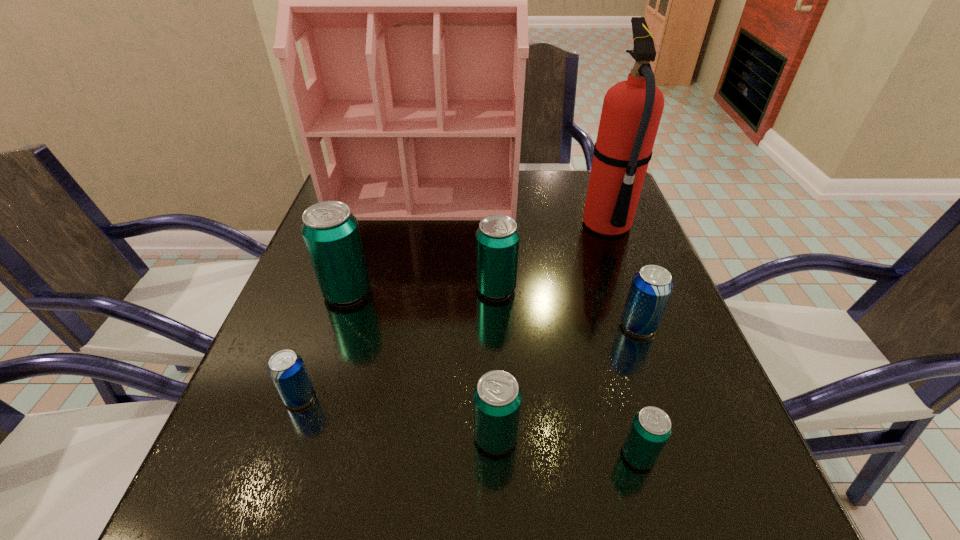
At what (x,y) coordinates should I click in order to perform the action: click on blank region between the smaller blue beer can and the third biggest teal beer can. Please return your answer as a coordinate pair (x, y). The height and width of the screenshot is (540, 960). Looking at the image, I should click on (397, 416).

Find the location of a particular element. This screenshot has width=960, height=540. free point between the red fire extinguisher and the third biggest teal beer can is located at coordinates (551, 330).

The width and height of the screenshot is (960, 540). In order to click on vacant area that lies between the tallest beer can and the dollhouse in this screenshot , I will do `click(386, 245)`.

Where is `the seventh closest object relative to the smaller blue beer can`? the seventh closest object relative to the smaller blue beer can is located at coordinates (632, 109).

Locate an element on the screen. The image size is (960, 540). object identified as the seventh closest to the third nearest beer can is located at coordinates (632, 109).

Select which beer can appears as the fifth closest to the tallest beer can. Please provide its 2D coordinates. Your answer should be formatted as a tuple, i.e. [(x, y)], where the tuple contains the x and y coordinates of a point satisfying the conditions above.

[(650, 429)]

Locate which beer can is the closest to the red fire extinguisher. Please provide its 2D coordinates. Your answer should be formatted as a tuple, i.e. [(x, y)], where the tuple contains the x and y coordinates of a point satisfying the conditions above.

[(497, 239)]

Identify which teal beer can is the fourth nearest to the red fire extinguisher. Please provide its 2D coordinates. Your answer should be formatted as a tuple, i.e. [(x, y)], where the tuple contains the x and y coordinates of a point satisfying the conditions above.

[(330, 231)]

Locate which teal beer can is the third closest to the third biggest teal beer can. Please provide its 2D coordinates. Your answer should be formatted as a tuple, i.e. [(x, y)], where the tuple contains the x and y coordinates of a point satisfying the conditions above.

[(330, 231)]

Locate an element on the screen. The height and width of the screenshot is (540, 960). free location that satisfies the following two spatial constraints: 1. on the front side of the bigger blue beer can; 2. on the left side of the fifth shortest object is located at coordinates (497, 325).